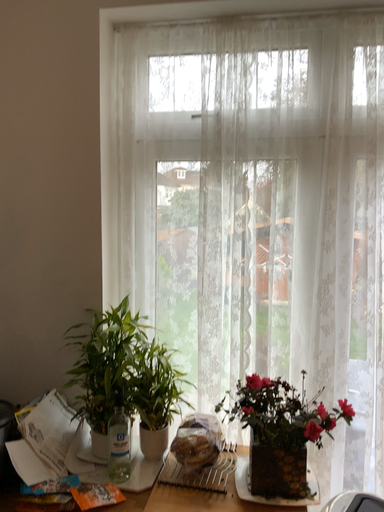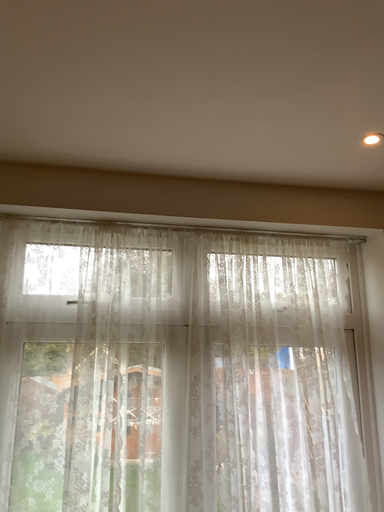
Question: How did the camera likely rotate when shooting the video?

Choices:
 (A) rotated left
 (B) rotated right

Answer: (B)